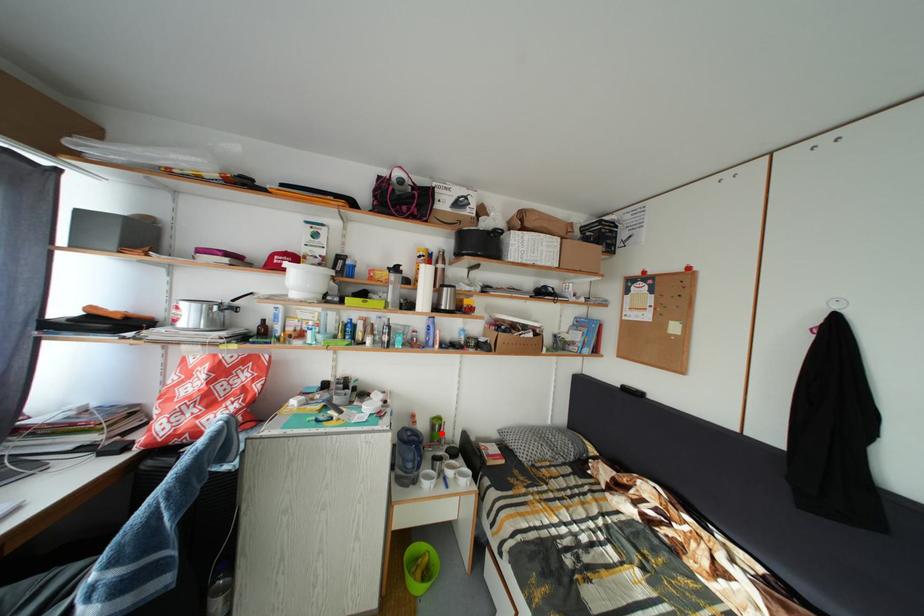
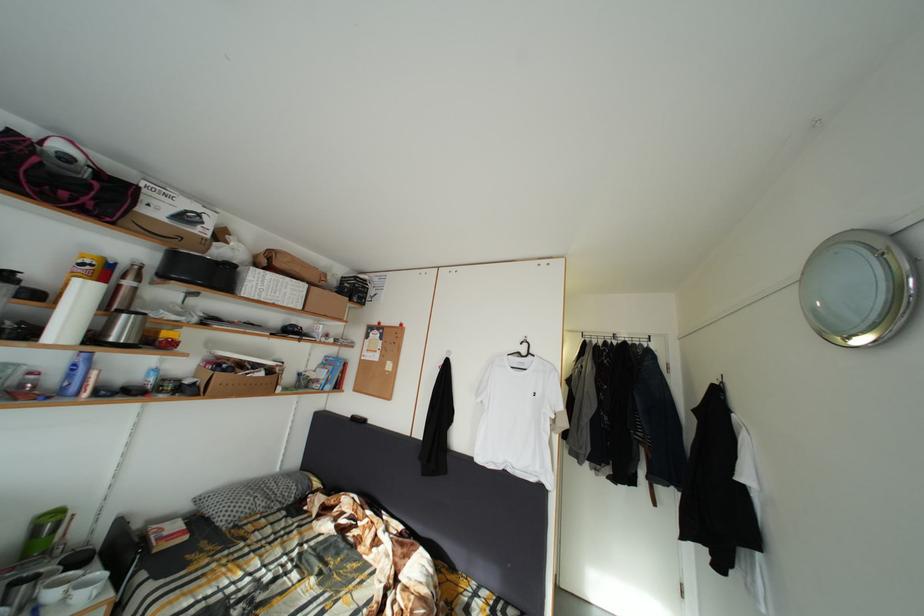
In the second image, find the point that corresponds to the highlighted location in the first image.

(44, 537)